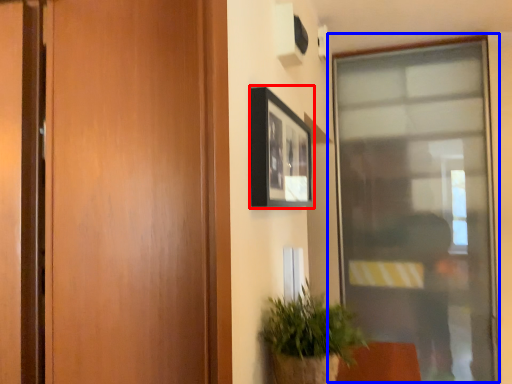
Question: Which object is closer to the camera taking this photo, picture frame (highlighted by a red box) or window (highlighted by a blue box)?

Choices:
 (A) picture frame
 (B) window

Answer: (A)